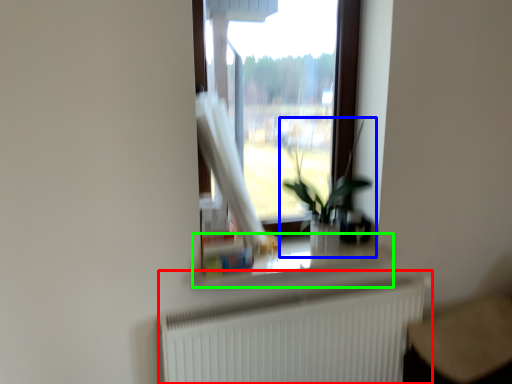
Question: Which is farther away from radiator (highlighted by a red box)? houseplant (highlighted by a blue box) or window sill (highlighted by a green box)?

Choices:
 (A) houseplant
 (B) window sill

Answer: (A)